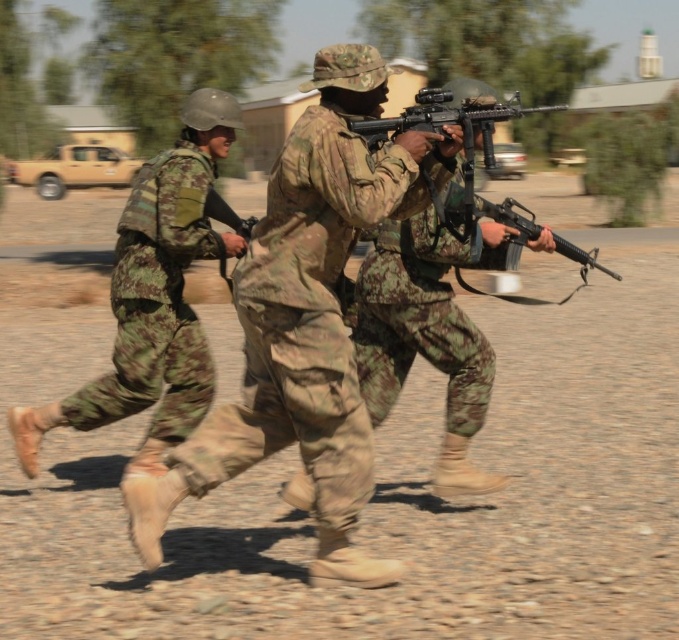
Based on the photo, you are a drone operator controlling a drone that is 0.5 meters tall. You need to hover the drone at the point marked as point (x=36, y=433). What is the minimum height you should set for the drone to avoid hitting the ground?

The point (x=36, y=433) is 5.30 meters away from the viewer. Since the drone is 0.5 meters tall, the minimum height should be at least 0.5 meters to avoid hitting the ground.

You are a military equipment inspector checking the dimensions of the camouflage fabric helmet at left and the camouflage fabric rifle at center. According to the description, which item might have a larger width?

The camouflage fabric helmet at left might be wider than the camouflage fabric rifle at center according to the description.